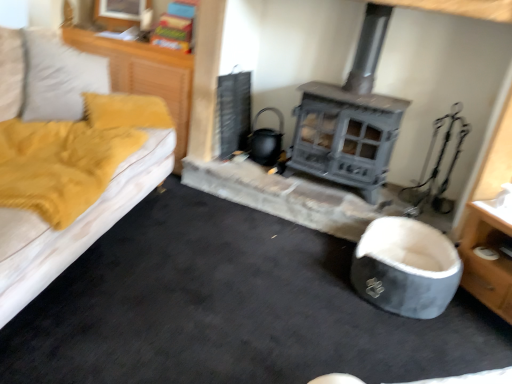
Question: Does gray fabric bean bag at lower right have a lesser height compared to yellow fabric at left, which appears as the second dresser when viewed from the right?

Choices:
 (A) no
 (B) yes

Answer: (B)

Question: Is gray fabric bean bag at lower right directly adjacent to yellow fabric at left, which appears as the second dresser when viewed from the right?

Choices:
 (A) yes
 (B) no

Answer: (B)

Question: From a real-world perspective, does gray fabric bean bag at lower right sit lower than yellow fabric at left, which ranks as the 1th dresser in left-to-right order?

Choices:
 (A) yes
 (B) no

Answer: (A)

Question: Is gray fabric bean bag at lower right further to the viewer compared to yellow fabric at left, which appears as the second dresser when ordered from the bottom?

Choices:
 (A) yes
 (B) no

Answer: (B)

Question: From the image's perspective, is gray fabric bean bag at lower right on top of yellow fabric at left, which ranks as the 1th dresser in left-to-right order?

Choices:
 (A) no
 (B) yes

Answer: (A)

Question: Relative to wooden dresser at lower right, the 1th dresser from the bottom, is yellow fabric at left, the 1th dresser positioned from the top, in front or behind?

Choices:
 (A) front
 (B) behind

Answer: (B)

Question: Is yellow fabric at left, the 1th dresser positioned from the top, taller or shorter than wooden dresser at lower right, the second dresser in the left-to-right sequence?

Choices:
 (A) tall
 (B) short

Answer: (A)

Question: Looking at the image, does yellow fabric at left, the 1th dresser positioned from the top, seem bigger or smaller compared to wooden dresser at lower right, the 1th dresser from the bottom?

Choices:
 (A) big
 (B) small

Answer: (B)

Question: Is point pos(170,107) positioned closer to the camera than point pos(487,248)?

Choices:
 (A) closer
 (B) farther

Answer: (B)

Question: Based on their sizes in the image, would you say gray fabric bean bag at lower right is bigger or smaller than wooden dresser at lower right, the second dresser in the left-to-right sequence?

Choices:
 (A) big
 (B) small

Answer: (B)

Question: Is gray fabric bean bag at lower right wider or thinner than wooden dresser at lower right, the second dresser in the left-to-right sequence?

Choices:
 (A) wide
 (B) thin

Answer: (B)

Question: Is gray fabric bean bag at lower right in front of or behind wooden dresser at lower right, the 1th dresser from the bottom, in the image?

Choices:
 (A) front
 (B) behind

Answer: (B)

Question: Choose the correct answer: Is gray fabric bean bag at lower right inside wooden dresser at lower right, positioned as the first dresser in right-to-left order, or outside it?

Choices:
 (A) inside
 (B) outside

Answer: (B)

Question: Is wooden dresser at lower right, positioned as the first dresser in right-to-left order, taller or shorter than gray fabric bean bag at lower right?

Choices:
 (A) short
 (B) tall

Answer: (B)

Question: Is wooden dresser at lower right, the second dresser in the left-to-right sequence, in front of or behind gray fabric bean bag at lower right in the image?

Choices:
 (A) behind
 (B) front

Answer: (B)